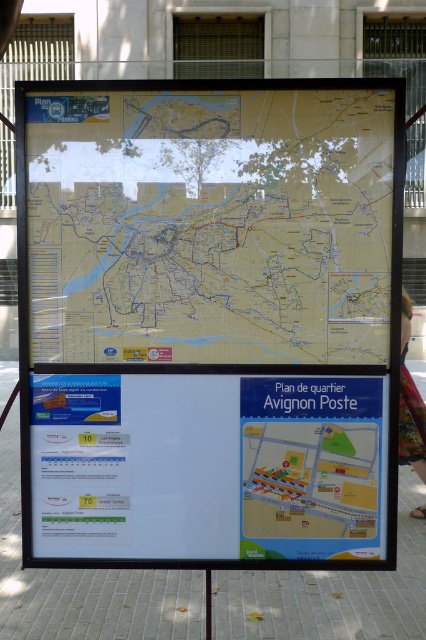
Question: Which of the following is the closest to the observer?

Choices:
 (A) white paper at center
 (B) blue paper map at center
 (C) yellow paper map at center

Answer: (C)

Question: Among these objects, which one is farthest from the camera?

Choices:
 (A) white paper at center
 (B) blue paper map at center
 (C) yellow paper map at center

Answer: (A)

Question: Does yellow paper map at center appear over blue paper map at center?

Choices:
 (A) yes
 (B) no

Answer: (A)

Question: Can you confirm if yellow paper map at center is smaller than white paper at center?

Choices:
 (A) no
 (B) yes

Answer: (A)

Question: Which of the following is the farthest from the observer?

Choices:
 (A) (124, 470)
 (B) (66, 348)

Answer: (A)

Question: Is yellow paper map at center below blue paper map at center?

Choices:
 (A) yes
 (B) no

Answer: (B)